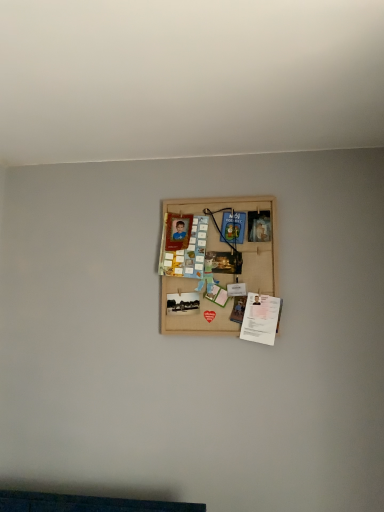
Question: Should I look upward or downward to see white paper at lower right?

Choices:
 (A) down
 (B) up

Answer: (A)

Question: Is white paper at lower right facing away from bamboo mat board at center?

Choices:
 (A) yes
 (B) no

Answer: (A)

Question: Does white paper at lower right have a greater width compared to bamboo mat board at center?

Choices:
 (A) no
 (B) yes

Answer: (B)

Question: Does white paper at lower right have a greater height compared to bamboo mat board at center?

Choices:
 (A) yes
 (B) no

Answer: (B)

Question: Would you say white paper at lower right is a long distance from bamboo mat board at center?

Choices:
 (A) no
 (B) yes

Answer: (A)

Question: From a real-world perspective, is white paper at lower right under bamboo mat board at center?

Choices:
 (A) yes
 (B) no

Answer: (A)

Question: Does white paper at lower right have a smaller size compared to bamboo mat board at center?

Choices:
 (A) no
 (B) yes

Answer: (B)

Question: Can you confirm if bamboo mat board at center is bigger than white paper at lower right?

Choices:
 (A) yes
 (B) no

Answer: (A)

Question: From a real-world perspective, does bamboo mat board at center stand above white paper at lower right?

Choices:
 (A) yes
 (B) no

Answer: (A)

Question: Does bamboo mat board at center have a greater width compared to white paper at lower right?

Choices:
 (A) yes
 (B) no

Answer: (B)

Question: Is bamboo mat board at center positioned behind white paper at lower right?

Choices:
 (A) no
 (B) yes

Answer: (B)

Question: Does bamboo mat board at center have a greater height compared to white paper at lower right?

Choices:
 (A) yes
 (B) no

Answer: (A)

Question: Does bamboo mat board at center have a lesser height compared to white paper at lower right?

Choices:
 (A) yes
 (B) no

Answer: (B)

Question: Looking at their shapes, would you say bamboo mat board at center is wider or thinner than white paper at lower right?

Choices:
 (A) thin
 (B) wide

Answer: (A)